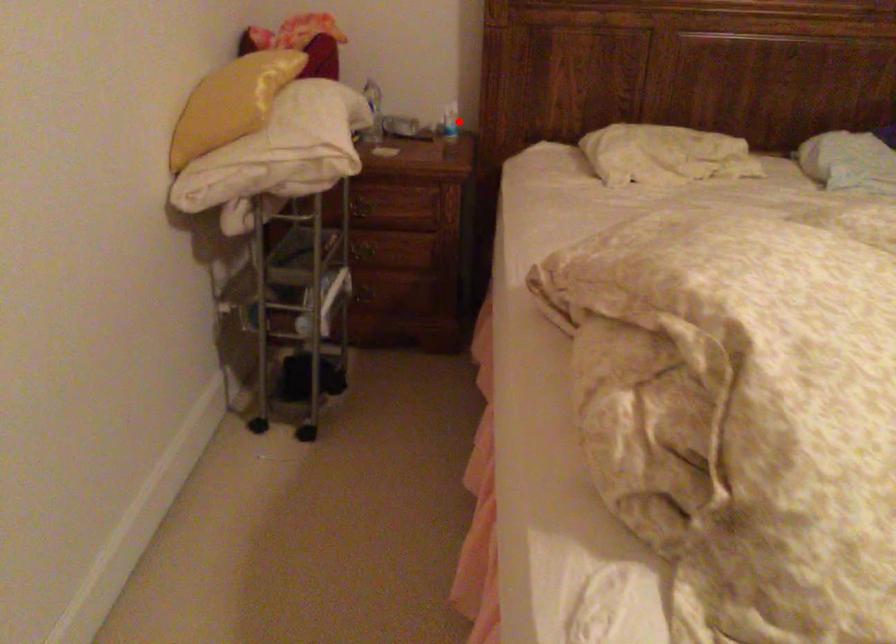
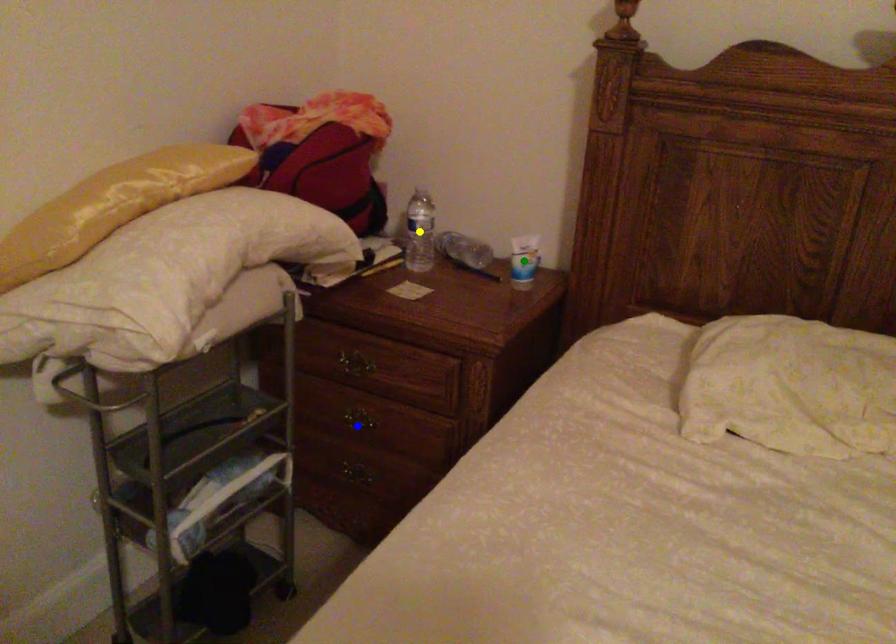
Question: I am providing you with two images of the same scene from different viewpoints. A red point is marked on the first image. You are given multiple points on the second image. Which spot in image 2 lines up with the point in image 1?

Choices:
 (A) yellow point
 (B) blue point
 (C) green point

Answer: (C)